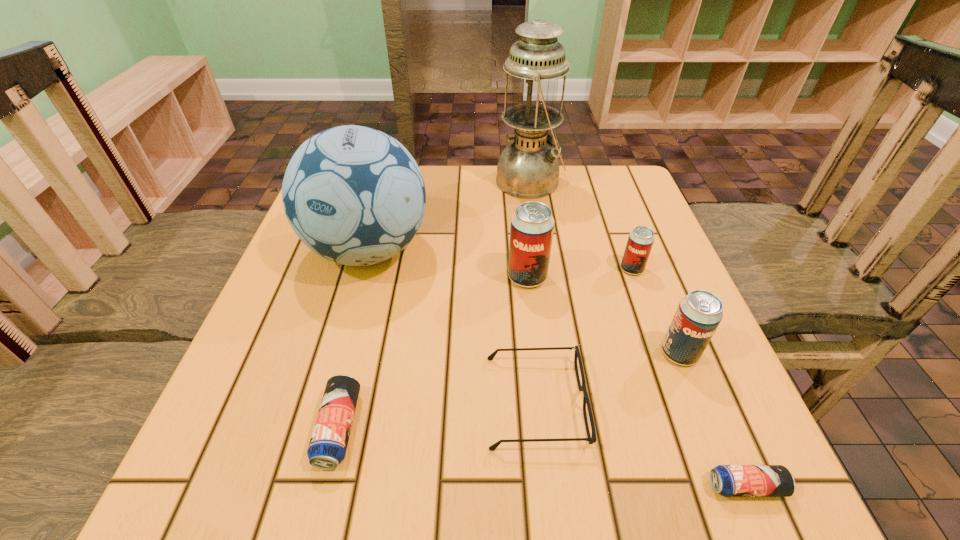
I want to click on vacant space that's between the spectacles and the fourth beer can from right to left, so click(532, 339).

You are a GUI agent. You are given a task and a screenshot of the screen. Output one action in this format:
    pyautogui.click(x=<x>, y=<y>)
    Task: Click on the free area in between the spectacles and the leftmost red beer can
    The image size is (960, 540).
    Given the screenshot: What is the action you would take?
    pyautogui.click(x=532, y=339)

Where is `free space between the bigger blue beer can and the nearest beer can`? This screenshot has height=540, width=960. free space between the bigger blue beer can and the nearest beer can is located at coordinates (542, 457).

I want to click on blank region between the shortest beer can and the blue soccer ball, so click(x=557, y=368).

At what (x,y) coordinates should I click in order to perform the action: click on the seventh closest object to the second tallest beer can. Please return your answer as a coordinate pair (x, y). Looking at the image, I should click on (328, 444).

You are a GUI agent. You are given a task and a screenshot of the screen. Output one action in this format:
    pyautogui.click(x=<x>, y=<y>)
    Task: Click on the object that is the fourth nearest to the spectacles
    This screenshot has height=540, width=960.
    Given the screenshot: What is the action you would take?
    pyautogui.click(x=354, y=195)

Where is `the second closest beer can relative to the fifth tallest object`? The height and width of the screenshot is (540, 960). the second closest beer can relative to the fifth tallest object is located at coordinates (699, 313).

The image size is (960, 540). Identify the location of beer can object that ranks as the closest to the fifth tallest object. (532, 225).

You are a GUI agent. You are given a task and a screenshot of the screen. Output one action in this format:
    pyautogui.click(x=<x>, y=<y>)
    Task: Click on the third closest red beer can relative to the blue soccer ball
    The height and width of the screenshot is (540, 960).
    Given the screenshot: What is the action you would take?
    pyautogui.click(x=699, y=313)

Locate an element on the screen. The image size is (960, 540). red beer can that stands as the third closest to the spectacles is located at coordinates (640, 241).